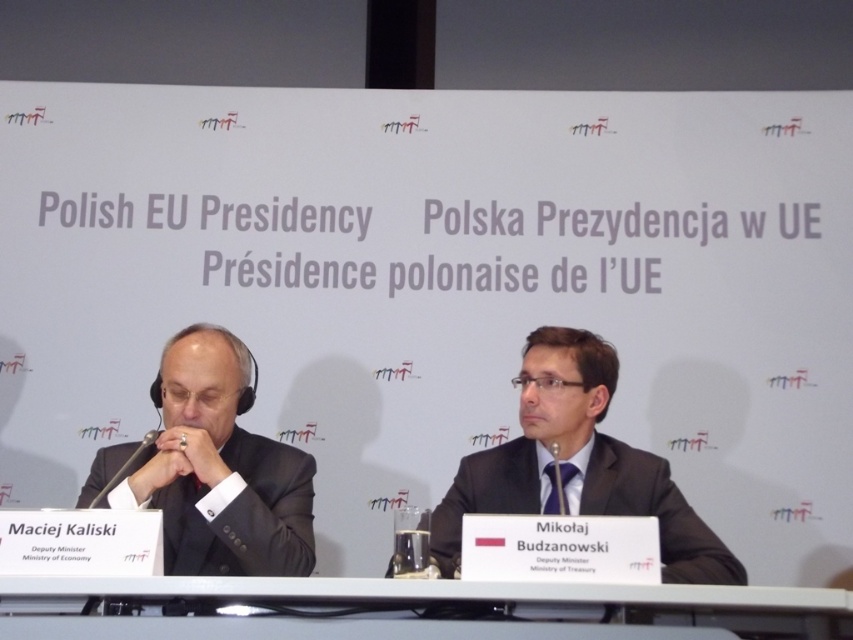
Is the position of black matte suit at left less distant than that of matte black suit at center?

No.

Is black matte suit at left to the left of matte black suit at center from the viewer's perspective?

Correct, you'll find black matte suit at left to the left of matte black suit at center.

Where is `black matte suit at left`? The width and height of the screenshot is (853, 640). black matte suit at left is located at coordinates pyautogui.click(x=219, y=468).

This screenshot has width=853, height=640. Identify the location of black matte suit at left. (219, 468).

This screenshot has width=853, height=640. Describe the element at coordinates (576, 465) in the screenshot. I see `matte black suit at center` at that location.

Does matte black suit at center have a lesser width compared to gray plastic table at center?

Yes, matte black suit at center is thinner than gray plastic table at center.

The image size is (853, 640). What do you see at coordinates (576, 465) in the screenshot?
I see `matte black suit at center` at bounding box center [576, 465].

Identify the location of matte black suit at center. (576, 465).

Between black matte suit at left and gray plastic table at center, which one is positioned lower?

gray plastic table at center

Is point (181, 385) closer to viewer compared to point (332, 580)?

No.

Does point (216, 416) come farther from viewer compared to point (283, 602)?

Yes, point (216, 416) is farther from viewer.

Locate an element on the screen. black matte suit at left is located at coordinates click(219, 468).